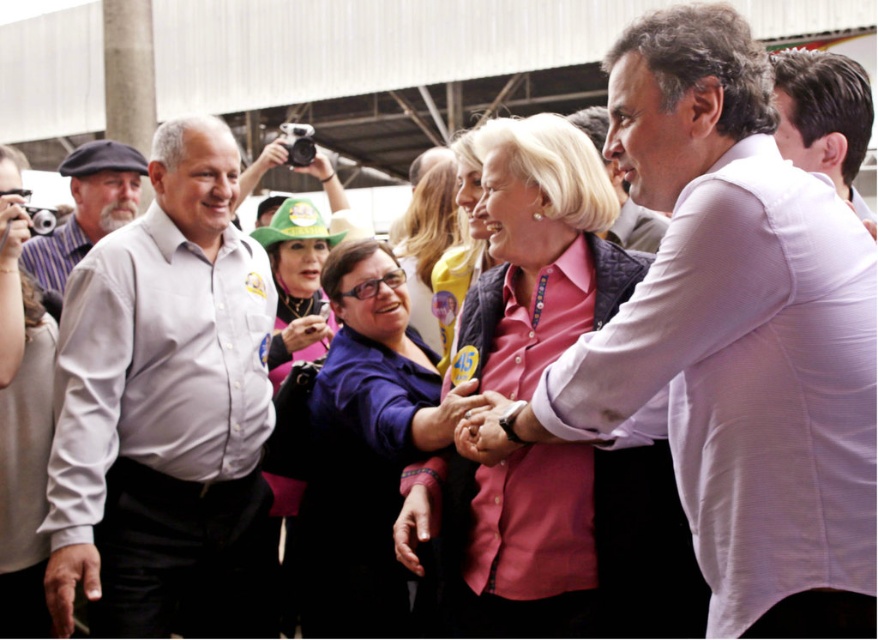
You are at a social event and want to take a photo with both the white shirt at center and the matte gray cap at left. Which object should you focus on first if you want to capture both in the same frame without moving your camera?

You should focus on the white shirt at center first because it is larger than the matte gray cap at left, allowing it to be more prominently visible while still including the smaller matte gray cap at left in the frame.

You are at a social event and want to introduce yourself to both the matte gray shirt at upper left and the white shirt at upper right. Which person should you approach first if you want to greet the one closer to your current position?

The matte gray shirt at upper left is below the white shirt at upper right, so the matte gray shirt at upper left is closer to your current position. You should approach the matte gray shirt at upper left first.